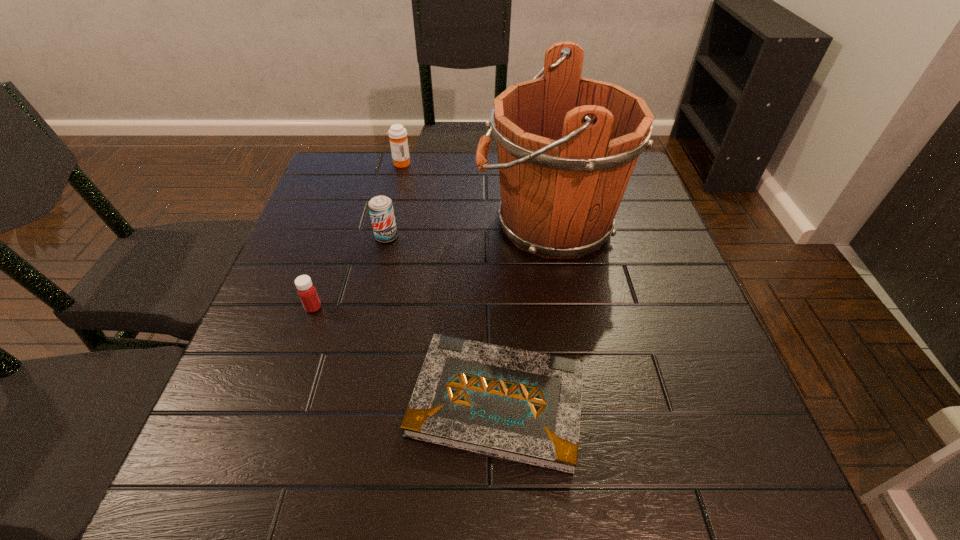
Identify the location of object located at the far right corner. The height and width of the screenshot is (540, 960). (567, 146).

Where is `vacant area at the far edge of the desktop`? Image resolution: width=960 pixels, height=540 pixels. vacant area at the far edge of the desktop is located at coordinates 466,191.

This screenshot has width=960, height=540. I want to click on blank space at the left edge of the desktop, so click(345, 245).

Identify the location of vacant region at the right edge of the desktop. The height and width of the screenshot is (540, 960). (671, 262).

Locate an element on the screen. Image resolution: width=960 pixels, height=540 pixels. free space at the far left corner of the desktop is located at coordinates (364, 174).

You are a GUI agent. You are given a task and a screenshot of the screen. Output one action in this format:
    pyautogui.click(x=<x>, y=<y>)
    Task: Click on the vacant space at the near right corner of the desktop
    
    Given the screenshot: What is the action you would take?
    pyautogui.click(x=667, y=463)

The height and width of the screenshot is (540, 960). I want to click on empty space that is in between the farther medicine and the second nearest object, so click(357, 235).

Identify the location of free space between the beer can and the farther medicine. (394, 200).

The height and width of the screenshot is (540, 960). I want to click on unoccupied position between the shortest object and the right medicine, so click(449, 282).

In order to click on vacant space that's between the bucket and the beer can in this screenshot , I will do `click(468, 230)`.